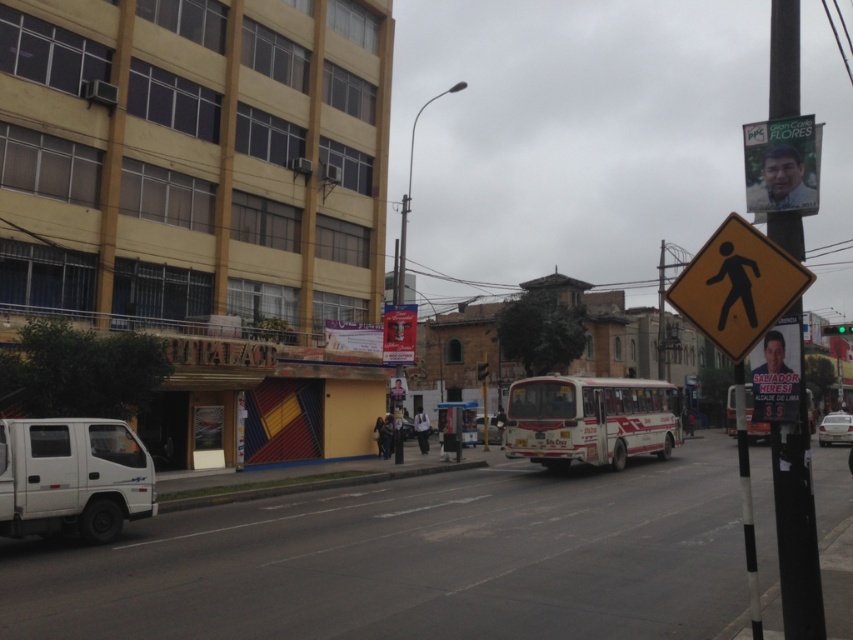
Is yellow reflective pedestrian crossing sign at upper right above white glossy bus at center?

Yes.

Is the position of yellow reflective pedestrian crossing sign at upper right less distant than that of white glossy bus at center?

Yes, yellow reflective pedestrian crossing sign at upper right is in front of white glossy bus at center.

You are a GUI agent. You are given a task and a screenshot of the screen. Output one action in this format:
    pyautogui.click(x=<x>, y=<y>)
    Task: Click on the yellow reflective pedestrian crossing sign at upper right
    The width and height of the screenshot is (853, 640).
    Given the screenshot: What is the action you would take?
    pyautogui.click(x=737, y=288)

In order to click on yellow reflective pedestrian crossing sign at upper right in this screenshot , I will do `click(737, 288)`.

Is point (730, 390) behind point (838, 333)?

Yes, it is.

Is point (728, 435) more distant than point (831, 326)?

Yes, point (728, 435) is farther from viewer.

Locate an element on the screen. This screenshot has height=640, width=853. white glossy bus at center is located at coordinates (751, 419).

Where is `metallic pole at right`? Image resolution: width=853 pixels, height=640 pixels. metallic pole at right is located at coordinates (796, 540).

Is point (814, 579) closer to viewer compared to point (784, 196)?

That is True.

This screenshot has height=640, width=853. What are the coordinates of `metallic pole at right` in the screenshot? It's located at (796, 540).